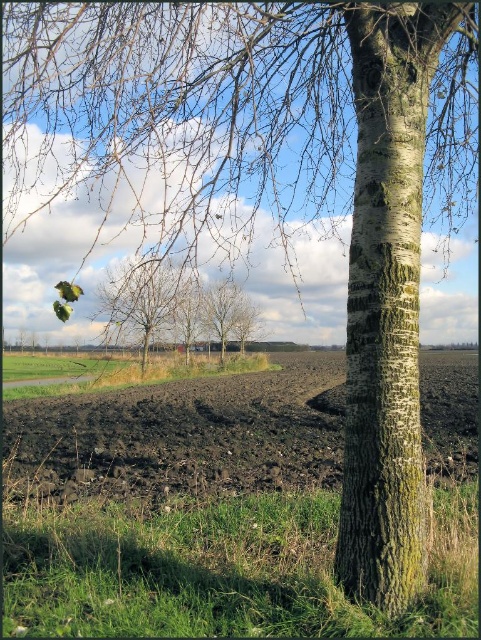
Can you confirm if bare branches at center is positioned below smooth bark tree at center?

No.

Who is higher up, bare branches at center or smooth bark tree at center?

bare branches at center

Where is `bare branches at center`? The width and height of the screenshot is (481, 640). bare branches at center is located at coordinates (141, 300).

Which is more to the right, barky white tree trunk at right or bare branches at center?

barky white tree trunk at right is more to the right.

Is point (407, 468) closer to camera compared to point (176, 285)?

That is True.

Image resolution: width=481 pixels, height=640 pixels. I want to click on barky white tree trunk at right, so click(x=387, y=300).

At what (x,y) coordinates should I click in order to perform the action: click on barky white tree trunk at right. Please return your answer as a coordinate pair (x, y). The width and height of the screenshot is (481, 640). Looking at the image, I should click on (387, 300).

Between barky white tree trunk at right and dark brown soil at lower left, which one is positioned higher?

Positioned higher is barky white tree trunk at right.

Is point (383, 582) farther from camera compared to point (471, 413)?

No.

Find the location of a particular element. This screenshot has height=640, width=481. barky white tree trunk at right is located at coordinates (387, 300).

The image size is (481, 640). I want to click on barky white tree trunk at right, so click(x=387, y=300).